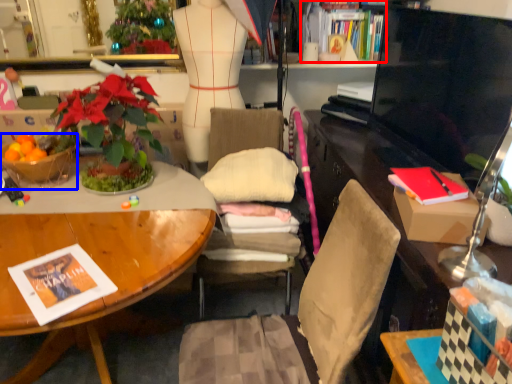
Question: Which object is further to the camera taking this photo, book (highlighted by a red box) or flowerpot (highlighted by a blue box)?

Choices:
 (A) book
 (B) flowerpot

Answer: (A)